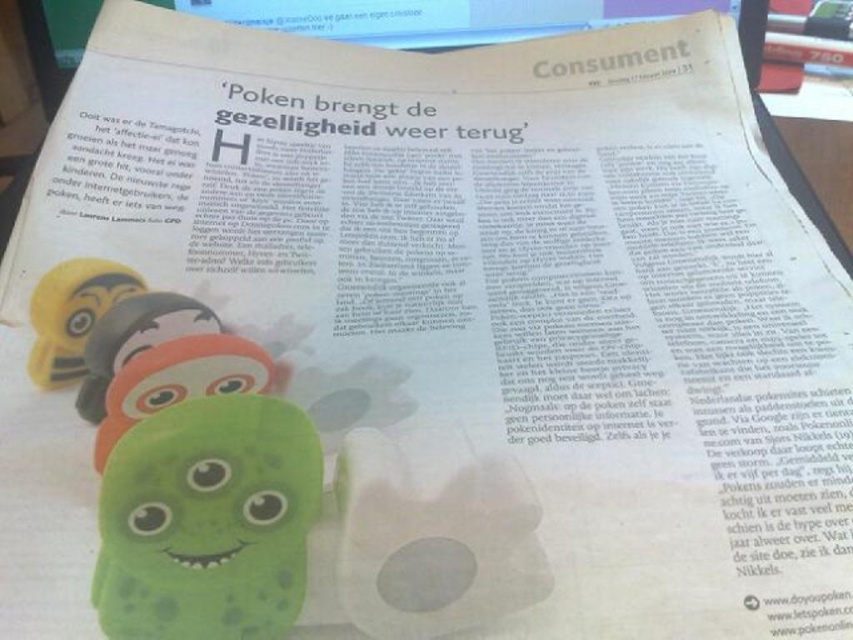
Question: Which point is closer to the camera?

Choices:
 (A) green rubber toy at center
 (B) matte yellow toy at left
 (C) green rubber toy at lower left
 (D) green rubber caterpillar at lower left

Answer: (C)

Question: Which object is closer to the camera taking this photo?

Choices:
 (A) matte yellow toy at left
 (B) green rubber caterpillar at lower left
 (C) green rubber toy at center

Answer: (C)

Question: Is green rubber toy at lower left behind green rubber caterpillar at lower left?

Choices:
 (A) no
 (B) yes

Answer: (A)

Question: Is green rubber toy at center to the right of green rubber caterpillar at lower left from the viewer's perspective?

Choices:
 (A) yes
 (B) no

Answer: (A)

Question: Among these points, which one is farthest from the camera?

Choices:
 (A) (32, 349)
 (B) (138, 365)
 (C) (86, 349)
 (D) (165, 634)

Answer: (A)

Question: Is the position of green rubber toy at lower left more distant than that of matte yellow toy at left?

Choices:
 (A) yes
 (B) no

Answer: (B)